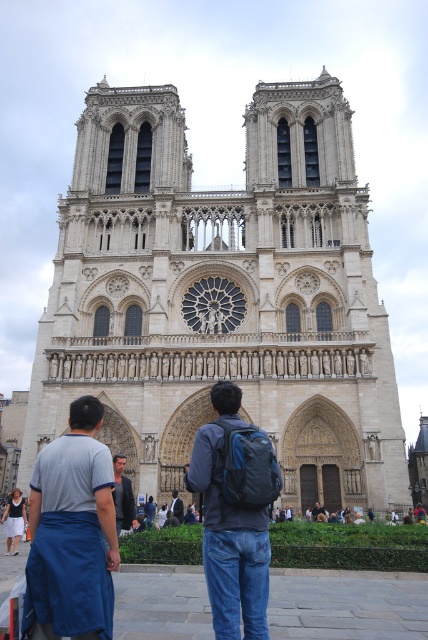
Question: Is the position of white stone cathedral at center more distant than that of white cotton skirt at lower left?

Choices:
 (A) no
 (B) yes

Answer: (B)

Question: Which point is closer to the camera?

Choices:
 (A) (234, 410)
 (B) (21, 524)

Answer: (A)

Question: Which object is farther from the camera taking this photo?

Choices:
 (A) white cotton skirt at lower left
 (B) matte blue backpack at center
 (C) white stone cathedral at center
 (D) blue fabric apron at lower left

Answer: (C)

Question: Is white stone cathedral at center thinner than matte blue backpack at center?

Choices:
 (A) no
 (B) yes

Answer: (A)

Question: Which point is farther to the camera?

Choices:
 (A) blue fabric apron at lower left
 (B) white cotton skirt at lower left

Answer: (B)

Question: Can you confirm if white stone cathedral at center is wider than blue fabric apron at lower left?

Choices:
 (A) no
 (B) yes

Answer: (B)